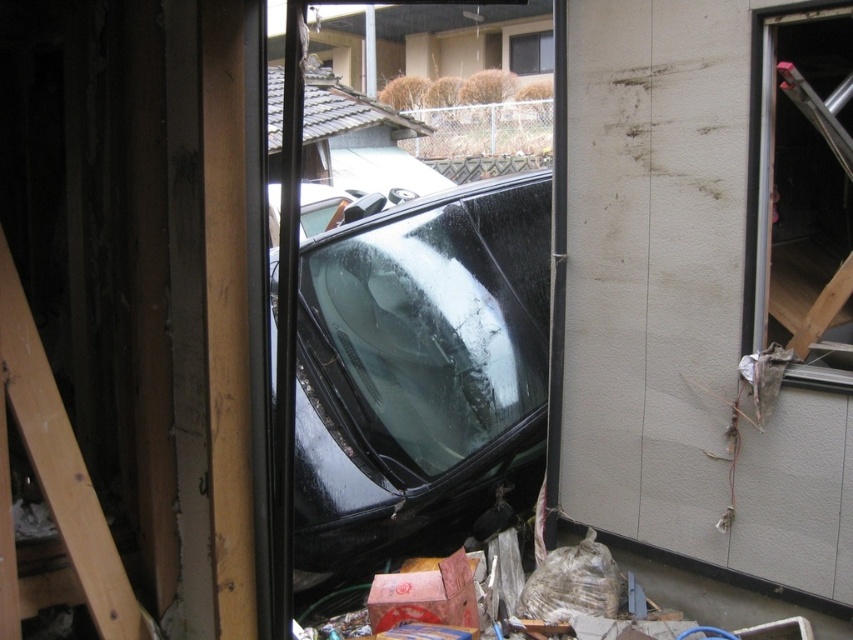
Question: Is transparent glass window at right positioned before clear glass window at upper center?

Choices:
 (A) yes
 (B) no

Answer: (A)

Question: Which object is positioned farthest from the clear glass window at upper center?

Choices:
 (A) wooden at left
 (B) glossy black windshield at center

Answer: (A)

Question: Can you confirm if glossy black windshield at center is positioned above clear glass window at upper center?

Choices:
 (A) no
 (B) yes

Answer: (A)

Question: Considering the relative positions of glossy black windshield at center and clear glass window at upper center in the image provided, where is glossy black windshield at center located with respect to clear glass window at upper center?

Choices:
 (A) above
 (B) below

Answer: (B)

Question: Based on their relative distances, which object is nearer to the glossy black windshield at center?

Choices:
 (A) transparent glass window at right
 (B) clear glass window at upper center
 (C) wooden at left

Answer: (A)

Question: Which point appears farthest from the camera in this image?

Choices:
 (A) (526, 42)
 (B) (402, 381)
 (C) (792, 381)

Answer: (A)